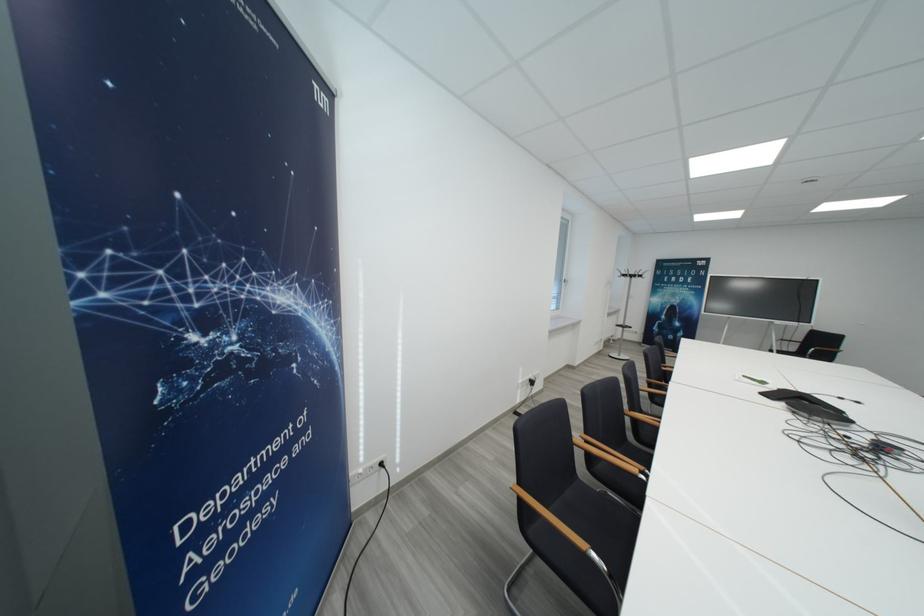
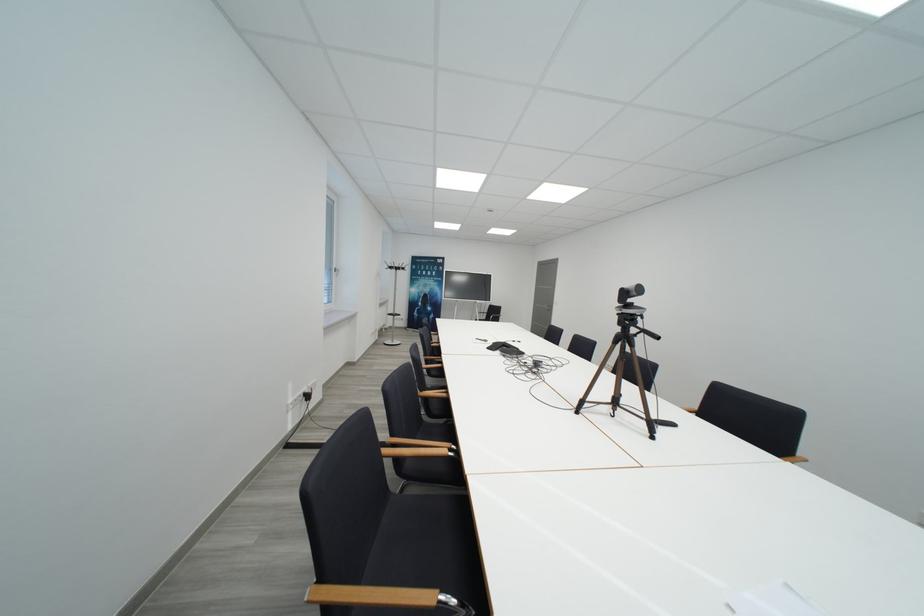
The point at (630, 278) is marked in the first image. Where is the corresponding point in the second image?

(397, 270)